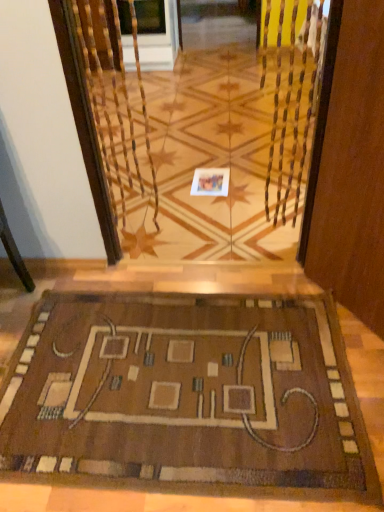
This screenshot has height=512, width=384. Describe the element at coordinates (210, 182) in the screenshot. I see `white paper at center` at that location.

Image resolution: width=384 pixels, height=512 pixels. What do you see at coordinates (186, 395) in the screenshot? I see `brown woven mat at lower center` at bounding box center [186, 395].

I want to click on transparent glass door at center, so click(x=212, y=150).

This screenshot has width=384, height=512. Find the location of `glass door in front of the white paper at center`. glass door in front of the white paper at center is located at coordinates (212, 150).

Looking at this image, is transparent glass door at center looking in the opposite direction of white paper at center?

Yes, white paper at center is at the back of transparent glass door at center.

Would you say transparent glass door at center is outside white paper at center?

Yes, transparent glass door at center is located beyond the bounds of white paper at center.

Is transparent glass door at center inside white paper at center?

No.

Is white paper at center beside transparent glass door at center?

white paper at center and transparent glass door at center are not in contact.

Between white paper at center and transparent glass door at center, which one has larger size?

With larger size is transparent glass door at center.

From a real-world perspective, which object rests below the other?

white paper at center.

Which is less distant, (165, 212) or (215, 340)?

The point (215, 340) is closer.

What's the angular difference between transparent glass door at center and brown woven mat at lower center's facing directions?

0.329 degrees.

Is transparent glass door at center positioned before brown woven mat at lower center?

No, transparent glass door at center is further to the viewer.

Between transparent glass door at center and brown woven mat at lower center, which one appears on the left side from the viewer's perspective?

brown woven mat at lower center is more to the left.

In the image, is brown woven mat at lower center positioned in front of or behind white paper at center?

brown woven mat at lower center is in front of white paper at center.

Who is shorter, brown woven mat at lower center or white paper at center?

brown woven mat at lower center is shorter.

Considering the positions of points (319, 341) and (213, 172), is point (319, 341) closer to camera compared to point (213, 172)?

Yes, point (319, 341) is closer to viewer.

Is brown woven mat at lower center aimed at transparent glass door at center?

No, brown woven mat at lower center is not facing towards transparent glass door at center.

From their relative heights in the image, would you say brown woven mat at lower center is taller or shorter than transparent glass door at center?

In the image, brown woven mat at lower center appears to be shorter than transparent glass door at center.

Identify the location of glass door above the brown woven mat at lower center (from a real-world perspective). (212, 150).

Considering the relative sizes of brown woven mat at lower center and transparent glass door at center in the image provided, is brown woven mat at lower center bigger than transparent glass door at center?

No.

Could you tell me if white paper at center is turned towards brown woven mat at lower center?

Yes, white paper at center faces towards brown woven mat at lower center.

Is white paper at center with brown woven mat at lower center?

white paper at center is not next to brown woven mat at lower center, and they're not touching.

Relative to brown woven mat at lower center, is white paper at center in front or behind?

In the image, white paper at center appears behind brown woven mat at lower center.

From a real-world perspective, is white paper at center located higher than brown woven mat at lower center?

Actually, white paper at center is physically below brown woven mat at lower center in the real world.

Find the location of a particular element. The height and width of the screenshot is (512, 384). square below the transparent glass door at center (from a real-world perspective) is located at coordinates (210, 182).

Locate an element on the screen. glass door above the white paper at center (from a real-world perspective) is located at coordinates pos(212,150).

Which object lies nearer to the anchor point transparent glass door at center, brown woven mat at lower center or white paper at center?

Based on the image, white paper at center appears to be nearer to transparent glass door at center.

From the image, which object appears to be farther from transparent glass door at center, white paper at center or brown woven mat at lower center?

brown woven mat at lower center is further to transparent glass door at center.

When comparing their distances from brown woven mat at lower center, does transparent glass door at center or white paper at center seem further?

transparent glass door at center lies further to brown woven mat at lower center than the other object.

Which object lies nearer to the anchor point white paper at center, transparent glass door at center or brown woven mat at lower center?

Among the two, transparent glass door at center is located nearer to white paper at center.

Based on their spatial positions, is brown woven mat at lower center or transparent glass door at center further from white paper at center?

brown woven mat at lower center.

Looking at this image, which object lies further to the anchor point brown woven mat at lower center, white paper at center or transparent glass door at center?

The object further to brown woven mat at lower center is transparent glass door at center.

This screenshot has height=512, width=384. Find the location of `glass door between brown woven mat at lower center and white paper at center in the front-back direction`. glass door between brown woven mat at lower center and white paper at center in the front-back direction is located at coordinates (212, 150).